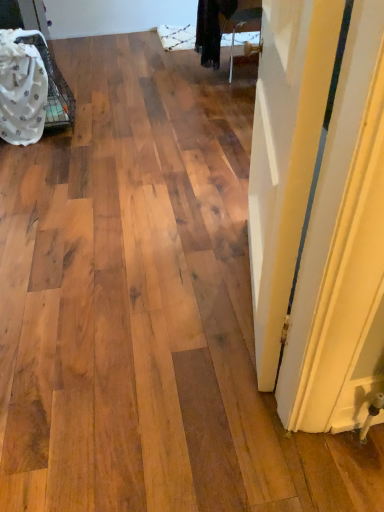
Image resolution: width=384 pixels, height=512 pixels. Describe the element at coordinates (22, 89) in the screenshot. I see `white fabric at left` at that location.

This screenshot has width=384, height=512. Identify the location of white fabric at left. (22, 89).

The image size is (384, 512). I want to click on white painted wood door at right, so click(343, 253).

What is the approximate height of white painted wood door at right?

The height of white painted wood door at right is 71.05 centimeters.

Measure the distance between point (372, 264) and camera.

A distance of 31.10 inches exists between point (372, 264) and camera.

In order to face white painted wood door at right, should I rotate leftwards or rightwards?

To align with it, rotate right about 20.173°.

The width and height of the screenshot is (384, 512). What do you see at coordinates (343, 253) in the screenshot?
I see `white painted wood door at right` at bounding box center [343, 253].

The image size is (384, 512). I want to click on white fabric at left, so (22, 89).

Considering the positions of objects white painted wood door at right and white fabric at left in the image provided, who is more to the right, white painted wood door at right or white fabric at left?

white painted wood door at right is more to the right.

Does white painted wood door at right come behind white fabric at left?

No.

Is point (351, 285) more distant than point (5, 41)?

No.

From the image's perspective, which one is positioned higher, white painted wood door at right or white fabric at left?

white fabric at left is shown above in the image.

From a real-world perspective, is white painted wood door at right under white fabric at left?

Actually, white painted wood door at right is physically above white fabric at left in the real world.

Considering the sizes of objects white painted wood door at right and white fabric at left in the image provided, who is wider, white painted wood door at right or white fabric at left?

white painted wood door at right.

Can you confirm if white painted wood door at right is taller than white fabric at left?

Correct, white painted wood door at right is much taller as white fabric at left.

Between white painted wood door at right and white fabric at left, which one has larger size?

Bigger between the two is white fabric at left.

Would you say white painted wood door at right is outside white fabric at left?

That's correct, white painted wood door at right is outside of white fabric at left.

Can you see white painted wood door at right touching white fabric at left?

No, white painted wood door at right is not in contact with white fabric at left.

Is white painted wood door at right facing away from white fabric at left?

No, white painted wood door at right is not facing the opposite direction of white fabric at left.

Can you tell me how much white painted wood door at right and white fabric at left differ in facing direction?

The facing directions of white painted wood door at right and white fabric at left are 89.1 degrees apart.

I want to click on door on the right of white fabric at left, so click(x=343, y=253).

Does white fabric at left appear on the right side of white painted wood door at right?

In fact, white fabric at left is to the left of white painted wood door at right.

Relative to white painted wood door at right, is white fabric at left in front or behind?

In the image, white fabric at left appears behind white painted wood door at right.

Considering the positions of point (32, 88) and point (316, 98), is point (32, 88) closer or farther from the camera than point (316, 98)?

Point (32, 88) appears to be farther away from the viewer than point (316, 98).

From the image's perspective, is white fabric at left above or below white painted wood door at right?

From the image's perspective, white fabric at left appears above white painted wood door at right.

From a real-world perspective, is white fabric at left physically located above or below white painted wood door at right?

white fabric at left is below white painted wood door at right.

Which of these two, white fabric at left or white painted wood door at right, is wider?

Wider between the two is white painted wood door at right.

Can you confirm if white fabric at left is taller than white painted wood door at right?

No.

Can you confirm if white fabric at left is smaller than white painted wood door at right?

Incorrect, white fabric at left is not smaller in size than white painted wood door at right.

Is white fabric at left located outside white painted wood door at right?

Yes.

Is white fabric at left touching white painted wood door at right?

No, white fabric at left is not making contact with white painted wood door at right.

Is white fabric at left turned away from white painted wood door at right?

No, white fabric at left's orientation is not away from white painted wood door at right.

Locate an element on the screen. The height and width of the screenshot is (512, 384). door that appears above the white fabric at left (from a real-world perspective) is located at coordinates (343, 253).

Locate an element on the screen. The height and width of the screenshot is (512, 384). material above the white painted wood door at right (from the image's perspective) is located at coordinates (22, 89).

Identify the location of material on the left side of white painted wood door at right. The image size is (384, 512). (22, 89).